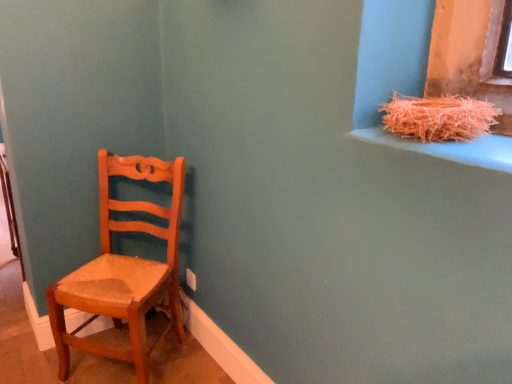
I want to click on orange shredded straw at upper right, so click(x=438, y=117).

What do you see at coordinates (438, 117) in the screenshot? I see `orange shredded straw at upper right` at bounding box center [438, 117].

What do you see at coordinates (123, 268) in the screenshot?
I see `wooden chair at left` at bounding box center [123, 268].

Find the location of a particular element. The image size is (512, 384). wooden chair at left is located at coordinates (123, 268).

Image resolution: width=512 pixels, height=384 pixels. Find the location of `orange shredded straw at upper right`. orange shredded straw at upper right is located at coordinates (438, 117).

Considering the positions of objects wooden chair at left and orange shredded straw at upper right in the image provided, who is more to the left, wooden chair at left or orange shredded straw at upper right?

wooden chair at left.

Based on the photo, considering the positions of objects wooden chair at left and orange shredded straw at upper right in the image provided, who is in front, wooden chair at left or orange shredded straw at upper right?

orange shredded straw at upper right is more forward.

Is point (71, 302) farther from camera compared to point (444, 131)?

Yes, it is.

From the image's perspective, relative to orange shredded straw at upper right, is wooden chair at left above or below?

wooden chair at left is situated lower than orange shredded straw at upper right in the image.

From a real-world perspective, who is located higher, wooden chair at left or orange shredded straw at upper right?

From a 3D spatial view, orange shredded straw at upper right is above.

Does wooden chair at left have a greater width compared to orange shredded straw at upper right?

Indeed, wooden chair at left has a greater width compared to orange shredded straw at upper right.

Between wooden chair at left and orange shredded straw at upper right, which one has less height?

Standing shorter between the two is orange shredded straw at upper right.

Between wooden chair at left and orange shredded straw at upper right, which one has smaller size?

Smaller between the two is orange shredded straw at upper right.

Would you say wooden chair at left is inside or outside orange shredded straw at upper right?

wooden chair at left lies outside orange shredded straw at upper right.

Is wooden chair at left directly adjacent to orange shredded straw at upper right?

wooden chair at left is not next to orange shredded straw at upper right, and they're not touching.

Does wooden chair at left turn towards orange shredded straw at upper right?

No, wooden chair at left is not aimed at orange shredded straw at upper right.

What's the angular difference between wooden chair at left and orange shredded straw at upper right's facing directions?

They differ by 37.4 degrees in their facing directions.

Measure the distance between wooden chair at left and orange shredded straw at upper right.

1.25 meters.

Image resolution: width=512 pixels, height=384 pixels. In the image, there is a orange shredded straw at upper right. In order to click on chair below it (from the image's perspective) in this screenshot , I will do `click(123, 268)`.

Visually, is orange shredded straw at upper right positioned to the left or to the right of wooden chair at left?

orange shredded straw at upper right is to the right of wooden chair at left.

Considering their positions, is orange shredded straw at upper right located in front of or behind wooden chair at left?

Clearly, orange shredded straw at upper right is in front of wooden chair at left.

Based on the photo, which point is more distant from viewer, (457,96) or (104,194)?

Positioned behind is point (104,194).

Looking at this image, from the image's perspective, between orange shredded straw at upper right and wooden chair at left, which one is located above?

From the image's view, orange shredded straw at upper right is above.

From a real-world perspective, is orange shredded straw at upper right above or below wooden chair at left?

Clearly, from a real-world perspective, orange shredded straw at upper right is above wooden chair at left.

Based on the photo, in terms of width, does orange shredded straw at upper right look wider or thinner when compared to wooden chair at left?

Clearly, orange shredded straw at upper right has less width compared to wooden chair at left.

Between orange shredded straw at upper right and wooden chair at left, which one has more height?

wooden chair at left.

Is orange shredded straw at upper right smaller than wooden chair at left?

Indeed, orange shredded straw at upper right has a smaller size compared to wooden chair at left.

Would you say orange shredded straw at upper right is inside or outside wooden chair at left?

orange shredded straw at upper right cannot be found inside wooden chair at left.

Is orange shredded straw at upper right not close to wooden chair at left?

Indeed, orange shredded straw at upper right is not near wooden chair at left.

Is orange shredded straw at upper right facing away from wooden chair at left?

No.

What's the angular difference between orange shredded straw at upper right and wooden chair at left's facing directions?

The angle between the facing direction of orange shredded straw at upper right and the facing direction of wooden chair at left is 37.4 degrees.

In order to click on chair that is below the orange shredded straw at upper right (from the image's perspective) in this screenshot , I will do `click(123, 268)`.

This screenshot has width=512, height=384. In order to click on chair that is below the orange shredded straw at upper right (from the image's perspective) in this screenshot , I will do `click(123, 268)`.

This screenshot has height=384, width=512. What are the coordinates of `straw that appears above the wooden chair at left (from a real-world perspective)` in the screenshot? It's located at (438, 117).